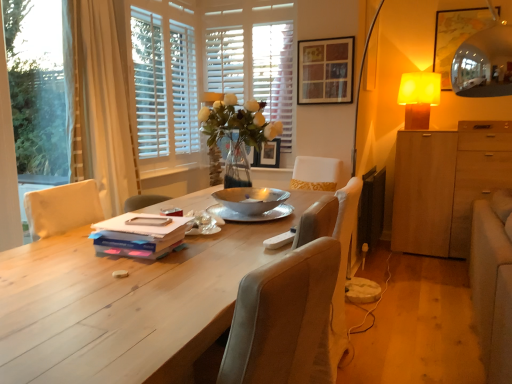
Question: Does wooden picture frame at upper center, which appears as the second picture frame when viewed from the front, appear on the left side of transparent plastic window screen at left?

Choices:
 (A) no
 (B) yes

Answer: (A)

Question: Can you confirm if wooden picture frame at upper center, acting as the first picture frame starting from the bottom, is thinner than transparent plastic window screen at left?

Choices:
 (A) yes
 (B) no

Answer: (B)

Question: From a real-world perspective, is wooden picture frame at upper center, acting as the first picture frame starting from the bottom, positioned under transparent plastic window screen at left based on gravity?

Choices:
 (A) yes
 (B) no

Answer: (A)

Question: Considering the relative sizes of wooden picture frame at upper center, acting as the first picture frame starting from the bottom, and transparent plastic window screen at left in the image provided, is wooden picture frame at upper center, acting as the first picture frame starting from the bottom, wider than transparent plastic window screen at left?

Choices:
 (A) no
 (B) yes

Answer: (B)

Question: Is wooden picture frame at upper center, which appears as the second picture frame when viewed from the front, in front of transparent plastic window screen at left?

Choices:
 (A) yes
 (B) no

Answer: (B)

Question: Is point (74, 13) positioned closer to the camera than point (269, 147)?

Choices:
 (A) farther
 (B) closer

Answer: (B)

Question: Visually, is beige fabric curtain at left positioned to the left or to the right of wooden picture frame at upper center, which appears as the first picture frame when viewed from the back?

Choices:
 (A) left
 (B) right

Answer: (A)

Question: Considering the positions of beige fabric curtain at left and wooden picture frame at upper center, which appears as the first picture frame when viewed from the back, in the image, is beige fabric curtain at left taller or shorter than wooden picture frame at upper center, which appears as the first picture frame when viewed from the back,?

Choices:
 (A) tall
 (B) short

Answer: (A)

Question: Is beige fabric curtain at left situated inside wooden picture frame at upper center, the 2th picture frame viewed from the right, or outside?

Choices:
 (A) inside
 (B) outside

Answer: (B)

Question: From the image's perspective, is beige fabric curtain at left located above or below matte blue book at center?

Choices:
 (A) above
 (B) below

Answer: (A)

Question: Considering the positions of beige fabric curtain at left and matte blue book at center in the image, is beige fabric curtain at left taller or shorter than matte blue book at center?

Choices:
 (A) short
 (B) tall

Answer: (B)

Question: Is beige fabric curtain at left inside the boundaries of matte blue book at center, or outside?

Choices:
 (A) inside
 (B) outside

Answer: (B)

Question: Looking at the image, does beige fabric curtain at left seem bigger or smaller compared to matte blue book at center?

Choices:
 (A) big
 (B) small

Answer: (A)

Question: Considering the positions of point (166, 155) and point (324, 62), is point (166, 155) closer or farther from the camera than point (324, 62)?

Choices:
 (A) farther
 (B) closer

Answer: (A)

Question: In terms of size, does white wood window frame at upper center appear bigger or smaller than wooden picture frame at upper center, which ranks as the first picture frame in front-to-back order?

Choices:
 (A) small
 (B) big

Answer: (B)